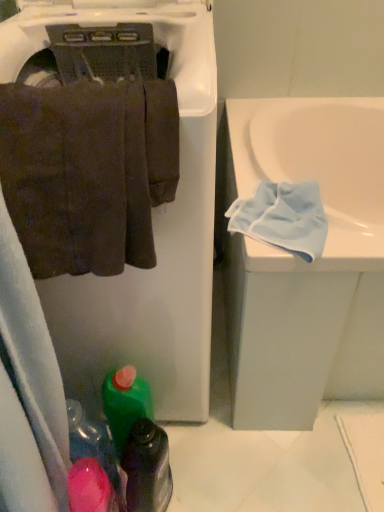
Question: Is light blue microfiber cloth at right in front of brown cotton towel at left?

Choices:
 (A) yes
 (B) no

Answer: (B)

Question: Could brown cotton towel at left be considered to be inside light blue microfiber cloth at right?

Choices:
 (A) yes
 (B) no

Answer: (B)

Question: From a real-world perspective, is light blue microfiber cloth at right under brown cotton towel at left?

Choices:
 (A) no
 (B) yes

Answer: (B)

Question: Is light blue microfiber cloth at right taller than brown cotton towel at left?

Choices:
 (A) yes
 (B) no

Answer: (B)

Question: Is the depth of light blue microfiber cloth at right greater than that of brown cotton towel at left?

Choices:
 (A) no
 (B) yes

Answer: (B)

Question: Considering the relative sizes of light blue microfiber cloth at right and brown cotton towel at left in the image provided, is light blue microfiber cloth at right shorter than brown cotton towel at left?

Choices:
 (A) yes
 (B) no

Answer: (A)

Question: Can you confirm if green plastic bottle at lower center, marked as the 2th bottle in a right-to-left arrangement, is positioned to the left of green plastic bottle at lower center, placed as the 1th bottle when sorted from right to left?

Choices:
 (A) yes
 (B) no

Answer: (A)

Question: Is green plastic bottle at lower center, marked as the 2th bottle in a right-to-left arrangement, not close to green plastic bottle at lower center, placed as the 1th bottle when sorted from right to left?

Choices:
 (A) yes
 (B) no

Answer: (B)

Question: Does green plastic bottle at lower center, acting as the 1th bottle starting from the left, have a larger size compared to green plastic bottle at lower center, placed as the 1th bottle when sorted from right to left?

Choices:
 (A) yes
 (B) no

Answer: (B)

Question: Is green plastic bottle at lower center, marked as the 2th bottle in a right-to-left arrangement, facing away from green plastic bottle at lower center, placed as the 1th bottle when sorted from right to left?

Choices:
 (A) yes
 (B) no

Answer: (B)

Question: From a real-world perspective, is green plastic bottle at lower center, acting as the 1th bottle starting from the left, under green plastic bottle at lower center, acting as the 2th bottle starting from the left?

Choices:
 (A) yes
 (B) no

Answer: (B)

Question: Is the position of green plastic bottle at lower center, marked as the 2th bottle in a right-to-left arrangement, less distant than that of green plastic bottle at lower center, acting as the 2th bottle starting from the left?

Choices:
 (A) no
 (B) yes

Answer: (A)

Question: From the image's perspective, is green plastic bottle at lower center, acting as the 2th bottle starting from the left, below green plastic bottle at lower center, marked as the 2th bottle in a right-to-left arrangement?

Choices:
 (A) no
 (B) yes

Answer: (B)